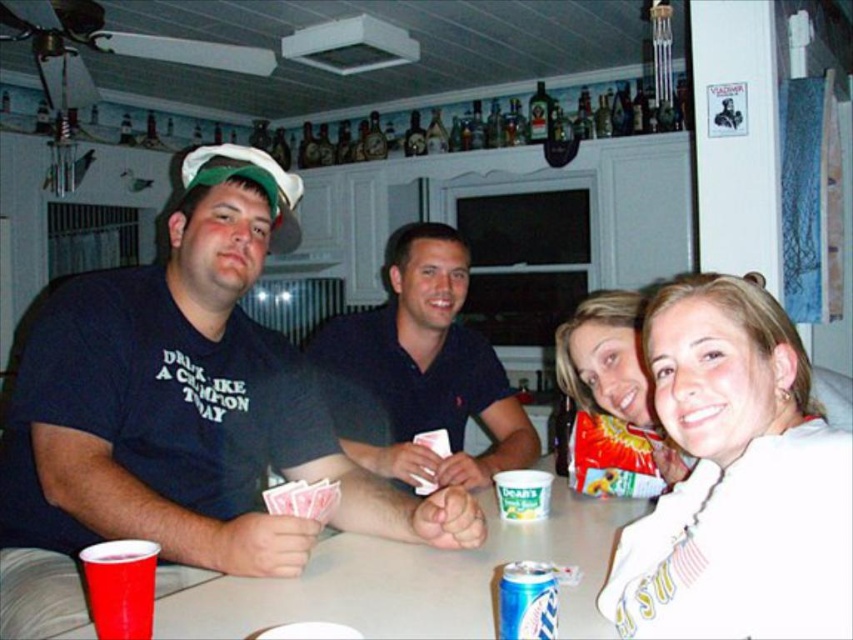
You are a delivery person who needs to place a small package between the smooth white shirt at lower right and the blue metallic can at lower center. The package is 50 centimeters long. Can you fit it between them?

The distance between the smooth white shirt at lower right and the blue metallic can at lower center is 51.59 centimeters. Since the package is 50 centimeters long, it can fit between them as there is enough space.

You are a guest at this gathering and want to place your phone on the table. The phone is 0.8 cm thick. Which item on the table, the white fleece sweatshirt at lower right or the smooth plastic cup at lower left, can you use as a stand to prop up your phone?

The white fleece sweatshirt at lower right is thinner than the smooth plastic cup at lower left. Since the phone is 0.8 cm thick, the smooth plastic cup at lower left, being thicker, can support the phone as a stand, while the sweatshirt may not provide enough height.

You are a photographer holding a camera. You want to take a photo of the smooth white shirt at lower right without moving the shirt. Can you move closer to the shirt while staying within the room to get a better closeup shot?

The smooth white shirt at lower right and camera are 1.37 meters apart. Since you can move closer to the shirt while staying within the room, you can reduce the distance between yourself and the shirt to achieve a better closeup shot.